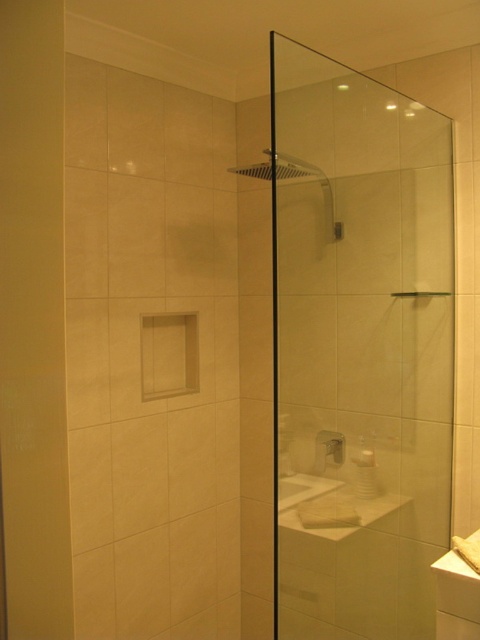
You are designing a layout for a bathroom and need to place a new storage cabinet. The cabinet requires a space wider than the white glossy sink at lower right. Can the transparent glass shower door at center provide enough width for this cabinet?

The transparent glass shower door at center is wider than the white glossy sink at lower right, so it can provide enough width for the cabinet that requires space wider than the sink.

You are standing in the bathroom and want to locate the transparent glass screen door at left. According to the 2D coordinates provided, where should you look?

The transparent glass screen door at left is located at the 2D coordinates point [33,323].

You are designing a new bathroom layout and want to place a bench between the transparent glass shower door at center and the transparent glass screen door at left. Given their widths, which door should the bench be placed closer to and why?

The bench should be placed closer to the transparent glass screen door at left because the transparent glass shower door at center is wider, leaving more space between them. Therefore, positioning the bench near the narrower door ensures better balance and utilization of the available space.